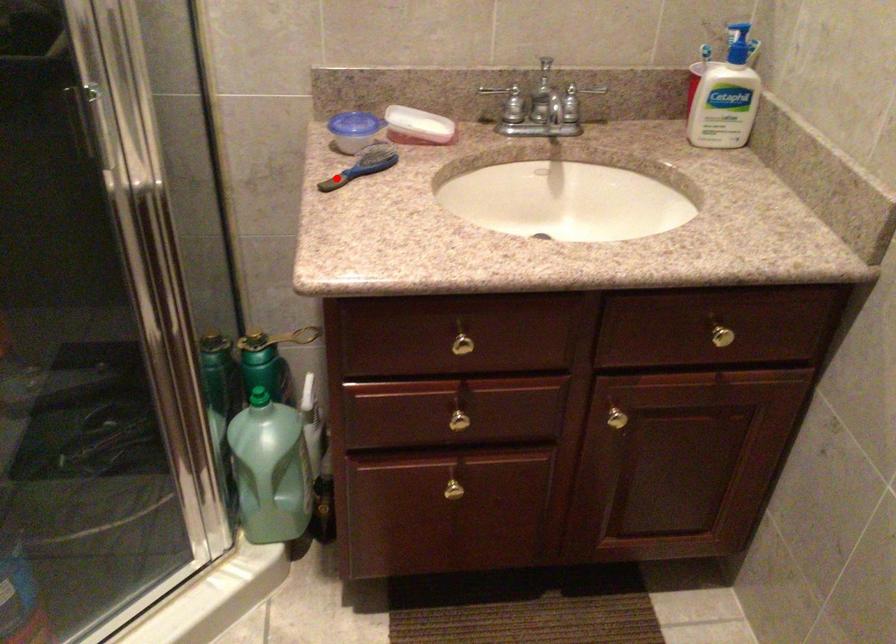
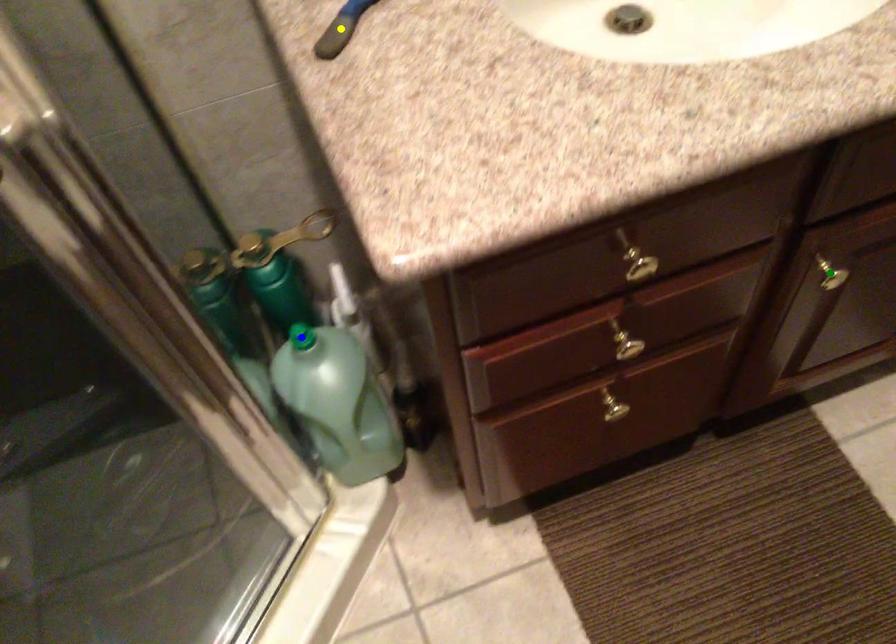
Question: I am providing you with two images of the same scene from different viewpoints. A red point is marked on the first image. You are given multiple points on the second image. Which spot in image 2 lines up with the point in image 1?

Choices:
 (A) green point
 (B) blue point
 (C) yellow point

Answer: (C)